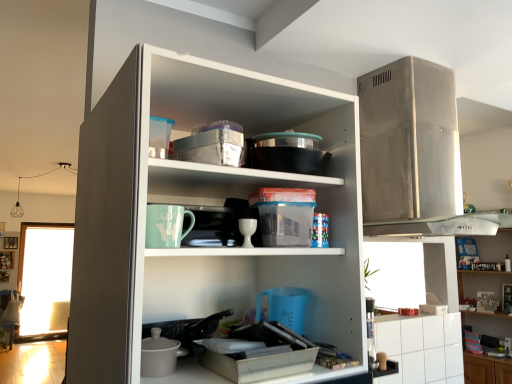
Question: From the image's perspective, is transparent glass window at left on top of white glossy cabinet at upper right?

Choices:
 (A) yes
 (B) no

Answer: (B)

Question: Is transparent glass window at left oriented away from white glossy cabinet at upper right?

Choices:
 (A) no
 (B) yes

Answer: (A)

Question: Does transparent glass window at left have a lesser height compared to white glossy cabinet at upper right?

Choices:
 (A) yes
 (B) no

Answer: (B)

Question: Can you see transparent glass window at left touching white glossy cabinet at upper right?

Choices:
 (A) no
 (B) yes

Answer: (A)

Question: Is transparent glass window at left wider than white glossy cabinet at upper right?

Choices:
 (A) no
 (B) yes

Answer: (A)

Question: Considering the positions of point (449, 349) and point (247, 225), is point (449, 349) closer or farther from the camera than point (247, 225)?

Choices:
 (A) farther
 (B) closer

Answer: (A)

Question: From a real-world perspective, relative to white glossy cup at center, is white glossy cabinet at lower right vertically above or below?

Choices:
 (A) above
 (B) below

Answer: (B)

Question: From the image's perspective, is white glossy cabinet at lower right positioned above or below white glossy cup at center?

Choices:
 (A) above
 (B) below

Answer: (B)

Question: Which is correct: white glossy cabinet at lower right is inside white glossy cup at center, or outside of it?

Choices:
 (A) inside
 (B) outside

Answer: (B)

Question: Considering the positions of point (468, 319) and point (209, 187), is point (468, 319) closer or farther from the camera than point (209, 187)?

Choices:
 (A) closer
 (B) farther

Answer: (B)

Question: Is white glossy cabinet at upper right spatially inside white matte cupboard at center, or outside of it?

Choices:
 (A) inside
 (B) outside

Answer: (B)

Question: Based on their sizes in the image, would you say white glossy cabinet at upper right is bigger or smaller than white matte cupboard at center?

Choices:
 (A) small
 (B) big

Answer: (B)

Question: From a real-world perspective, relative to white matte cupboard at center, is white glossy cabinet at upper right vertically above or below?

Choices:
 (A) below
 (B) above

Answer: (A)

Question: Considering the positions of point (448, 178) and point (244, 218), is point (448, 178) closer or farther from the camera than point (244, 218)?

Choices:
 (A) farther
 (B) closer

Answer: (A)

Question: In the image, is stainless steel range hood at upper right, which is the first appliance in top-to-bottom order, on the left side or the right side of white glossy cup at center?

Choices:
 (A) right
 (B) left

Answer: (A)